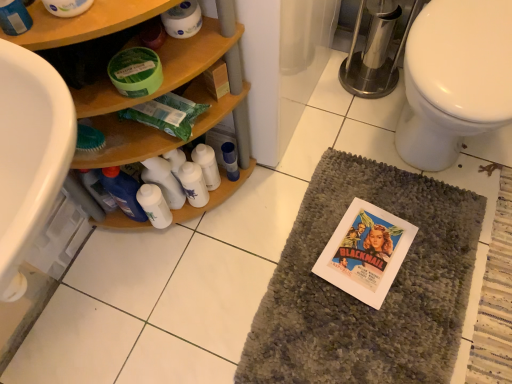
Identify the location of vacant location below gray textured bath mat at center (from a real-world perspective). (385, 296).